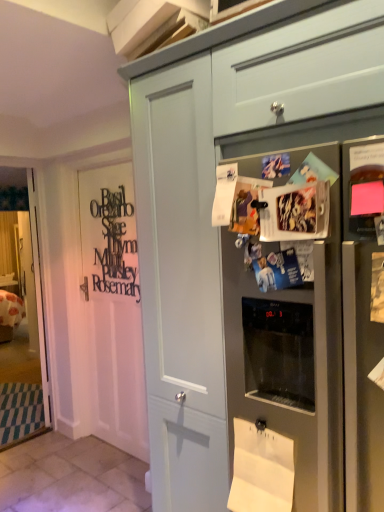
Image resolution: width=384 pixels, height=512 pixels. In order to click on free space to the back side of clear glass door at left in this screenshot , I will do `click(29, 433)`.